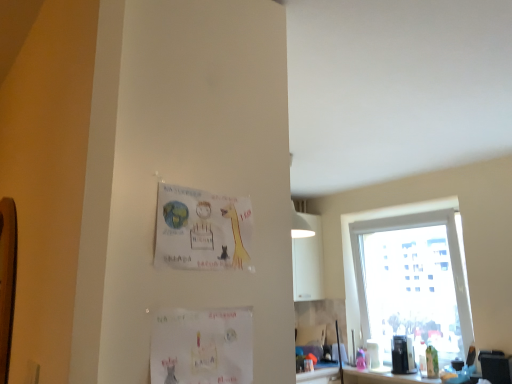
What do you see at coordinates (7, 280) in the screenshot? This screenshot has height=384, width=512. I see `wooden bulletin board at left` at bounding box center [7, 280].

Locate an element on the screen. wooden bulletin board at left is located at coordinates (7, 280).

Considering the sizes of objects transparent glass window at right and white paper postcard at lower center, placed as the 2th postcard when sorted from top to bottom, in the image provided, who is taller, transparent glass window at right or white paper postcard at lower center, placed as the 2th postcard when sorted from top to bottom,?

transparent glass window at right is taller.

Identify the location of window that is on the right side of white paper postcard at lower center, which is counted as the 1th postcard, starting from the bottom. (408, 279).

Is transparent glass window at right further to camera compared to white paper postcard at lower center, which is counted as the 1th postcard, starting from the bottom?

Yes, it is behind white paper postcard at lower center, which is counted as the 1th postcard, starting from the bottom.

Does point (453, 232) come closer to viewer compared to point (219, 352)?

No, it is behind (219, 352).

Are matte paper postcard at upper center, the second postcard ordered from the bottom, and transparent glass window at right far apart?

Absolutely, matte paper postcard at upper center, the second postcard ordered from the bottom, is distant from transparent glass window at right.

Would you say matte paper postcard at upper center, the second postcard ordered from the bottom, is to the left or to the right of transparent glass window at right in the picture?

Clearly, matte paper postcard at upper center, the second postcard ordered from the bottom, is on the left of transparent glass window at right in the image.

Is matte paper postcard at upper center, the second postcard ordered from the bottom, turned away from transparent glass window at right?

matte paper postcard at upper center, the second postcard ordered from the bottom, is not turned away from transparent glass window at right.

Looking at the image, does matte paper postcard at upper center, the second postcard ordered from the bottom, seem bigger or smaller compared to transparent glass window at right?

Clearly, matte paper postcard at upper center, the second postcard ordered from the bottom, is smaller in size than transparent glass window at right.

Between point (1, 214) and point (198, 229), which one is positioned behind?

The point (1, 214) is behind.

Considering the sizes of wooden bulletin board at left and matte paper postcard at upper center, the second postcard ordered from the bottom, in the image, is wooden bulletin board at left taller or shorter than matte paper postcard at upper center, the second postcard ordered from the bottom,?

In the image, wooden bulletin board at left appears to be taller than matte paper postcard at upper center, the second postcard ordered from the bottom.

Does wooden bulletin board at left have a lesser width compared to matte paper postcard at upper center, marked as the first postcard in a top-to-bottom arrangement?

In fact, wooden bulletin board at left might be wider than matte paper postcard at upper center, marked as the first postcard in a top-to-bottom arrangement.

Which is behind, wooden bulletin board at left or matte paper postcard at upper center, marked as the first postcard in a top-to-bottom arrangement?

wooden bulletin board at left is further from the camera.

Would you say transparent glass window at right is part of white paper postcard at lower center, placed as the 2th postcard when sorted from top to bottom,'s contents?

No, transparent glass window at right is not a part of white paper postcard at lower center, placed as the 2th postcard when sorted from top to bottom.

Is white paper postcard at lower center, placed as the 2th postcard when sorted from top to bottom, to the left of transparent glass window at right from the viewer's perspective?

Yes.

Are white paper postcard at lower center, placed as the 2th postcard when sorted from top to bottom, and transparent glass window at right beside each other?

white paper postcard at lower center, placed as the 2th postcard when sorted from top to bottom, and transparent glass window at right are not in contact.

From a real-world perspective, which object stands above the other?

transparent glass window at right, from a real-world perspective.

Consider the image. From a real-world perspective, is white paper postcard at lower center, which is counted as the 1th postcard, starting from the bottom, below matte paper postcard at upper center, the second postcard ordered from the bottom?

Yes, from a real-world perspective, white paper postcard at lower center, which is counted as the 1th postcard, starting from the bottom, is beneath matte paper postcard at upper center, the second postcard ordered from the bottom.

From the image's perspective, is white paper postcard at lower center, which is counted as the 1th postcard, starting from the bottom, located beneath matte paper postcard at upper center, marked as the first postcard in a top-to-bottom arrangement?

Correct, white paper postcard at lower center, which is counted as the 1th postcard, starting from the bottom, appears lower than matte paper postcard at upper center, marked as the first postcard in a top-to-bottom arrangement, in the image.

In the image, is white paper postcard at lower center, which is counted as the 1th postcard, starting from the bottom, on the left side or the right side of matte paper postcard at upper center, the second postcard ordered from the bottom?

white paper postcard at lower center, which is counted as the 1th postcard, starting from the bottom, is to the right of matte paper postcard at upper center, the second postcard ordered from the bottom.

Between point (154, 382) and point (211, 224), which one is positioned in front?

The point (154, 382) is more forward.

The height and width of the screenshot is (384, 512). Find the location of `bulletin board that appears above the white paper postcard at lower center, which is counted as the 1th postcard, starting from the bottom (from the image's perspective)`. bulletin board that appears above the white paper postcard at lower center, which is counted as the 1th postcard, starting from the bottom (from the image's perspective) is located at coordinates click(x=7, y=280).

Who is shorter, white paper postcard at lower center, which is counted as the 1th postcard, starting from the bottom, or wooden bulletin board at left?

white paper postcard at lower center, which is counted as the 1th postcard, starting from the bottom, is shorter.

Is point (218, 349) positioned before point (7, 252)?

That is True.

Based on their sizes in the image, would you say wooden bulletin board at left is bigger or smaller than transparent glass window at right?

In the image, wooden bulletin board at left appears to be smaller than transparent glass window at right.

Image resolution: width=512 pixels, height=384 pixels. I want to click on window on the right of wooden bulletin board at left, so click(x=408, y=279).

From a real-world perspective, between wooden bulletin board at left and transparent glass window at right, who is vertically lower?

In real-world perspective, transparent glass window at right is lower.

Is wooden bulletin board at left not within transparent glass window at right?

Yes, wooden bulletin board at left is located beyond the bounds of transparent glass window at right.

The height and width of the screenshot is (384, 512). In the image, there is a transparent glass window at right. Identify the location of postcard below it (from a real-world perspective). (202, 346).

Where is `window on the right of matte paper postcard at upper center, marked as the first postcard in a top-to-bottom arrangement`? window on the right of matte paper postcard at upper center, marked as the first postcard in a top-to-bottom arrangement is located at coordinates (408, 279).

Based on their spatial positions, is transparent glass window at right or white paper postcard at lower center, placed as the 2th postcard when sorted from top to bottom, further from wooden bulletin board at left?

Among the two, transparent glass window at right is located further to wooden bulletin board at left.

Considering their positions, is matte paper postcard at upper center, marked as the first postcard in a top-to-bottom arrangement, positioned closer to wooden bulletin board at left than transparent glass window at right?

The object closer to wooden bulletin board at left is matte paper postcard at upper center, marked as the first postcard in a top-to-bottom arrangement.

Which object lies further to the anchor point wooden bulletin board at left, transparent glass window at right or matte paper postcard at upper center, the second postcard ordered from the bottom?

transparent glass window at right lies further to wooden bulletin board at left than the other object.

Based on their spatial positions, is matte paper postcard at upper center, the second postcard ordered from the bottom, or white paper postcard at lower center, which is counted as the 1th postcard, starting from the bottom, closer to transparent glass window at right?

white paper postcard at lower center, which is counted as the 1th postcard, starting from the bottom, lies closer to transparent glass window at right than the other object.

Estimate the real-world distances between objects in this image. Which object is closer to wooden bulletin board at left, white paper postcard at lower center, which is counted as the 1th postcard, starting from the bottom, or transparent glass window at right?

white paper postcard at lower center, which is counted as the 1th postcard, starting from the bottom.

Estimate the real-world distances between objects in this image. Which object is closer to white paper postcard at lower center, placed as the 2th postcard when sorted from top to bottom, wooden bulletin board at left or transparent glass window at right?

The object closer to white paper postcard at lower center, placed as the 2th postcard when sorted from top to bottom, is wooden bulletin board at left.

When comparing their distances from matte paper postcard at upper center, the second postcard ordered from the bottom, does white paper postcard at lower center, which is counted as the 1th postcard, starting from the bottom, or wooden bulletin board at left seem further?

Among the two, wooden bulletin board at left is located further to matte paper postcard at upper center, the second postcard ordered from the bottom.

Which object lies nearer to the anchor point matte paper postcard at upper center, marked as the first postcard in a top-to-bottom arrangement, wooden bulletin board at left or white paper postcard at lower center, placed as the 2th postcard when sorted from top to bottom?

The object closer to matte paper postcard at upper center, marked as the first postcard in a top-to-bottom arrangement, is white paper postcard at lower center, placed as the 2th postcard when sorted from top to bottom.

Identify the location of postcard located between white paper postcard at lower center, which is counted as the 1th postcard, starting from the bottom, and transparent glass window at right in the depth direction. (202, 230).

Where is `postcard between wooden bulletin board at left and white paper postcard at lower center, placed as the 2th postcard when sorted from top to bottom`? postcard between wooden bulletin board at left and white paper postcard at lower center, placed as the 2th postcard when sorted from top to bottom is located at coordinates (202, 230).

What are the coordinates of `bulletin board between matte paper postcard at upper center, the second postcard ordered from the bottom, and transparent glass window at right from front to back` in the screenshot? It's located at (7, 280).

Where is `bulletin board located between white paper postcard at lower center, which is counted as the 1th postcard, starting from the bottom, and transparent glass window at right in the depth direction`? Image resolution: width=512 pixels, height=384 pixels. bulletin board located between white paper postcard at lower center, which is counted as the 1th postcard, starting from the bottom, and transparent glass window at right in the depth direction is located at coordinates (7, 280).